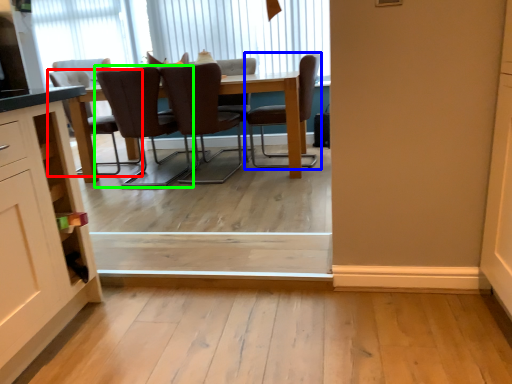
Question: Based on their relative distances, which object is farther from chair (highlighted by a red box)? Choose from chair (highlighted by a blue box) and chair (highlighted by a green box).

Choices:
 (A) chair
 (B) chair

Answer: (A)